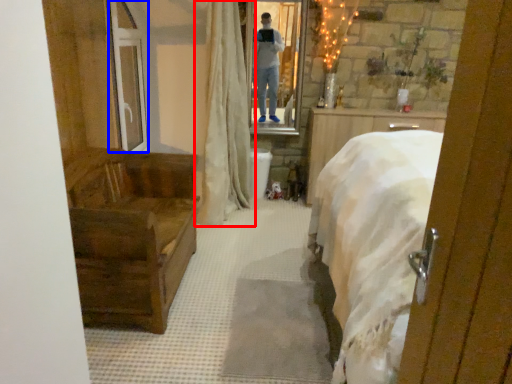
Question: Among these objects, which one is nearest to the camera, curtain (highlighted by a red box) or glass door (highlighted by a blue box)?

Choices:
 (A) curtain
 (B) glass door

Answer: (A)